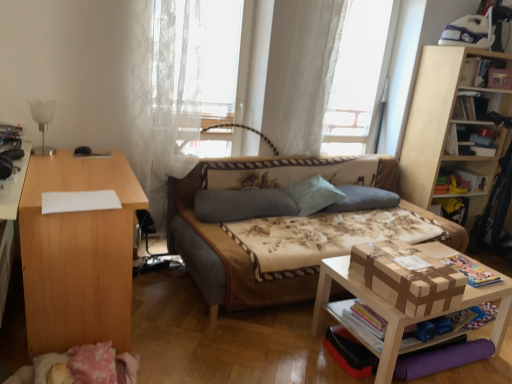
Question: Is hardcover book at upper right, the 2th book in the right-to-left sequence, positioned behind light blue fabric pillow at center, which ranks as the 2th pillow in left-to-right order?

Choices:
 (A) yes
 (B) no

Answer: (A)

Question: Are hardcover book at upper right, acting as the third book starting from the left, and light blue fabric pillow at center, which ranks as the 2th pillow in left-to-right order, beside each other?

Choices:
 (A) yes
 (B) no

Answer: (B)

Question: Is hardcover book at upper right, the third book when ordered from front to back, shorter than light blue fabric pillow at center, which ranks as the 2th pillow in left-to-right order?

Choices:
 (A) no
 (B) yes

Answer: (B)

Question: From the image's perspective, does hardcover book at upper right, the first book from the top, appear higher than light blue fabric pillow at center, which is the 2th pillow in right-to-left order?

Choices:
 (A) yes
 (B) no

Answer: (A)

Question: Considering the relative sizes of hardcover book at upper right, the 2th book in the right-to-left sequence, and light blue fabric pillow at center, which ranks as the 2th pillow in left-to-right order, in the image provided, is hardcover book at upper right, the 2th book in the right-to-left sequence, smaller than light blue fabric pillow at center, which ranks as the 2th pillow in left-to-right order,?

Choices:
 (A) yes
 (B) no

Answer: (A)

Question: Is point (464, 140) positioned closer to the camera than point (4, 124)?

Choices:
 (A) farther
 (B) closer

Answer: (A)

Question: From the image's perspective, is hardcover book at upper right, the fourth book in the left-to-right sequence, above or below hardcover book at left, the fourth book viewed from the right?

Choices:
 (A) below
 (B) above

Answer: (B)

Question: In the image, is hardcover book at upper right, the fourth book in the left-to-right sequence, positioned in front of or behind hardcover book at left, which ranks as the 3th book in back-to-front order?

Choices:
 (A) behind
 (B) front

Answer: (A)

Question: Is hardcover book at upper right, placed as the fourth book when sorted from front to back, taller or shorter than hardcover book at left, the fourth book viewed from the right?

Choices:
 (A) short
 (B) tall

Answer: (B)

Question: From a real-world perspective, relative to floral fabric studio couch at center, is white lace curtain at upper center vertically above or below?

Choices:
 (A) below
 (B) above

Answer: (B)

Question: In terms of width, does white lace curtain at upper center look wider or thinner when compared to floral fabric studio couch at center?

Choices:
 (A) wide
 (B) thin

Answer: (B)

Question: Relative to floral fabric studio couch at center, is white lace curtain at upper center in front or behind?

Choices:
 (A) behind
 (B) front

Answer: (A)

Question: Is point (349, 79) positioned closer to the camera than point (306, 271)?

Choices:
 (A) farther
 (B) closer

Answer: (A)

Question: Relative to white wood table at lower right, which is the first table in right-to-left order, is white lace curtain at upper center, the 2th curtain positioned from the left, in front or behind?

Choices:
 (A) behind
 (B) front

Answer: (A)

Question: In terms of height, does white lace curtain at upper center, which ranks as the first curtain in right-to-left order, look taller or shorter compared to white wood table at lower right, positioned as the second table in left-to-right order?

Choices:
 (A) tall
 (B) short

Answer: (A)